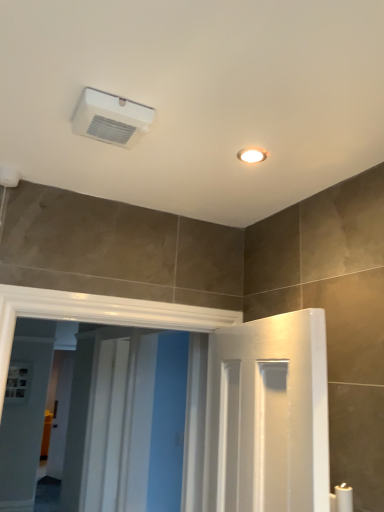
The image size is (384, 512). I want to click on white glossy screen door at center, arranged as the 2th screen door when viewed from the front, so click(x=105, y=426).

Describe the element at coordinates (137, 424) in the screenshot. I see `white glossy screen door at center, which ranks as the first screen door in front-to-back order` at that location.

This screenshot has height=512, width=384. In order to click on white glossy screen door at center, arranged as the 1th screen door when viewed from the back in this screenshot , I will do `click(105, 426)`.

Is white glossy screen door at center, the 2th screen door in the back-to-front sequence, positioned with its back to white plastic air conditioning unit at upper center?

No, white glossy screen door at center, the 2th screen door in the back-to-front sequence, is not facing the opposite direction of white plastic air conditioning unit at upper center.

Who is smaller, white glossy screen door at center, the 2th screen door in the back-to-front sequence, or white plastic air conditioning unit at upper center?

white plastic air conditioning unit at upper center is smaller.

From the image's perspective, between white glossy screen door at center, the 2th screen door in the back-to-front sequence, and white plastic air conditioning unit at upper center, which one is located above?

From the image's view, white plastic air conditioning unit at upper center is above.

From a real-world perspective, who is located lower, white glossy screen door at center, which ranks as the first screen door in front-to-back order, or white plastic air conditioning unit at upper center?

white glossy screen door at center, which ranks as the first screen door in front-to-back order.

Considering the sizes of objects white glossy screen door at center, arranged as the 2th screen door when viewed from the front, and white glossy screen door at center, which ranks as the first screen door in front-to-back order, in the image provided, who is smaller, white glossy screen door at center, arranged as the 2th screen door when viewed from the front, or white glossy screen door at center, which ranks as the first screen door in front-to-back order,?

white glossy screen door at center, arranged as the 2th screen door when viewed from the front.

Do you think white glossy screen door at center, arranged as the 2th screen door when viewed from the front, is within white glossy screen door at center, which ranks as the first screen door in front-to-back order, or outside of it?

white glossy screen door at center, arranged as the 2th screen door when viewed from the front, is located beyond the bounds of white glossy screen door at center, which ranks as the first screen door in front-to-back order.

From the image's perspective, which is below, white glossy screen door at center, arranged as the 1th screen door when viewed from the back, or white glossy screen door at center, the 2th screen door in the back-to-front sequence?

white glossy screen door at center, arranged as the 1th screen door when viewed from the back, is shown below in the image.

From a real-world perspective, is white glossy screen door at center, arranged as the 2th screen door when viewed from the front, positioned above or below white glossy screen door at center, which ranks as the first screen door in front-to-back order?

white glossy screen door at center, arranged as the 2th screen door when viewed from the front, is situated lower than white glossy screen door at center, which ranks as the first screen door in front-to-back order, in the real world.

Is point (110, 96) in front of point (120, 352)?

Yes, point (110, 96) is in front of point (120, 352).

Does white plastic air conditioning unit at upper center lie behind white glossy screen door at center, arranged as the 1th screen door when viewed from the back?

No, the depth of white plastic air conditioning unit at upper center is less than that of white glossy screen door at center, arranged as the 1th screen door when viewed from the back.

Considering the sizes of objects white plastic air conditioning unit at upper center and white glossy screen door at center, arranged as the 2th screen door when viewed from the front, in the image provided, who is thinner, white plastic air conditioning unit at upper center or white glossy screen door at center, arranged as the 2th screen door when viewed from the front,?

With smaller width is white glossy screen door at center, arranged as the 2th screen door when viewed from the front.

Can you confirm if white plastic air conditioning unit at upper center is shorter than white glossy screen door at center, arranged as the 2th screen door when viewed from the front?

Yes.

From a real-world perspective, which is physically above, white glossy screen door at center, arranged as the 1th screen door when viewed from the back, or white plastic air conditioning unit at upper center?

white plastic air conditioning unit at upper center is physically above.

Does white glossy screen door at center, arranged as the 2th screen door when viewed from the front, have a larger size compared to white plastic air conditioning unit at upper center?

Yes, white glossy screen door at center, arranged as the 2th screen door when viewed from the front, is bigger than white plastic air conditioning unit at upper center.

Which of these two, white glossy screen door at center, arranged as the 2th screen door when viewed from the front, or white plastic air conditioning unit at upper center, is thinner?

white glossy screen door at center, arranged as the 2th screen door when viewed from the front.

Who is taller, white plastic air conditioning unit at upper center or white glossy screen door at center, which ranks as the first screen door in front-to-back order?

white glossy screen door at center, which ranks as the first screen door in front-to-back order, is taller.

Considering the relative positions of white plastic air conditioning unit at upper center and white glossy screen door at center, which ranks as the first screen door in front-to-back order, in the image provided, is white plastic air conditioning unit at upper center to the right of white glossy screen door at center, which ranks as the first screen door in front-to-back order, from the viewer's perspective?

Yes, white plastic air conditioning unit at upper center is to the right of white glossy screen door at center, which ranks as the first screen door in front-to-back order.

Does white plastic air conditioning unit at upper center lie in front of white glossy screen door at center, which ranks as the first screen door in front-to-back order?

Yes, white plastic air conditioning unit at upper center is closer to the viewer.

Is the surface of white glossy screen door at center, the 2th screen door in the back-to-front sequence, in direct contact with white glossy screen door at center, arranged as the 2th screen door when viewed from the front?

They are not placed beside each other.

From the image's perspective, is white glossy screen door at center, which ranks as the first screen door in front-to-back order, under white glossy screen door at center, arranged as the 1th screen door when viewed from the back?

No, from the image's perspective, white glossy screen door at center, which ranks as the first screen door in front-to-back order, is not beneath white glossy screen door at center, arranged as the 1th screen door when viewed from the back.

Considering the positions of objects white glossy screen door at center, which ranks as the first screen door in front-to-back order, and white glossy screen door at center, arranged as the 2th screen door when viewed from the front, in the image provided, who is behind, white glossy screen door at center, which ranks as the first screen door in front-to-back order, or white glossy screen door at center, arranged as the 2th screen door when viewed from the front,?

white glossy screen door at center, arranged as the 2th screen door when viewed from the front, is more distant.

Does point (175, 476) appear closer or farther from the camera than point (97, 366)?

Point (175, 476) is closer to the camera than point (97, 366).

There is a white glossy screen door at center, which ranks as the first screen door in front-to-back order. Identify the location of air conditioning above it (from a real-world perspective). Image resolution: width=384 pixels, height=512 pixels. (111, 118).

The height and width of the screenshot is (512, 384). In the image, there is a white glossy screen door at center, which ranks as the first screen door in front-to-back order. Find the location of `screen door below it (from the image's perspective)`. screen door below it (from the image's perspective) is located at coordinates (105, 426).

From the image, which object appears to be nearer to white glossy screen door at center, arranged as the 1th screen door when viewed from the back, white glossy screen door at center, which ranks as the first screen door in front-to-back order, or white plastic air conditioning unit at upper center?

The object closer to white glossy screen door at center, arranged as the 1th screen door when viewed from the back, is white glossy screen door at center, which ranks as the first screen door in front-to-back order.

Based on their spatial positions, is white glossy screen door at center, arranged as the 2th screen door when viewed from the front, or white plastic air conditioning unit at upper center closer to white glossy screen door at center, the 2th screen door in the back-to-front sequence?

The object closer to white glossy screen door at center, the 2th screen door in the back-to-front sequence, is white glossy screen door at center, arranged as the 2th screen door when viewed from the front.

Based on their spatial positions, is white plastic air conditioning unit at upper center or white glossy screen door at center, the 2th screen door in the back-to-front sequence, further from white glossy screen door at center, arranged as the 1th screen door when viewed from the back?

white plastic air conditioning unit at upper center is further to white glossy screen door at center, arranged as the 1th screen door when viewed from the back.

Which object lies further to the anchor point white plastic air conditioning unit at upper center, white glossy screen door at center, arranged as the 1th screen door when viewed from the back, or white glossy screen door at center, which ranks as the first screen door in front-to-back order?

white glossy screen door at center, arranged as the 1th screen door when viewed from the back, is positioned further to the anchor white plastic air conditioning unit at upper center.

Consider the image. From the image, which object appears to be nearer to white plastic air conditioning unit at upper center, white glossy screen door at center, which ranks as the first screen door in front-to-back order, or white glossy screen door at center, arranged as the 2th screen door when viewed from the front?

white glossy screen door at center, which ranks as the first screen door in front-to-back order, lies closer to white plastic air conditioning unit at upper center than the other object.

From the picture: Estimate the real-world distances between objects in this image. Which object is closer to white glossy screen door at center, the 2th screen door in the back-to-front sequence, white plastic air conditioning unit at upper center or white glossy screen door at center, arranged as the 2th screen door when viewed from the front?

Among the two, white glossy screen door at center, arranged as the 2th screen door when viewed from the front, is located nearer to white glossy screen door at center, the 2th screen door in the back-to-front sequence.

Where is `screen door between white plastic air conditioning unit at upper center and white glossy screen door at center, arranged as the 2th screen door when viewed from the front, along the z-axis`? The height and width of the screenshot is (512, 384). screen door between white plastic air conditioning unit at upper center and white glossy screen door at center, arranged as the 2th screen door when viewed from the front, along the z-axis is located at coordinates (137, 424).